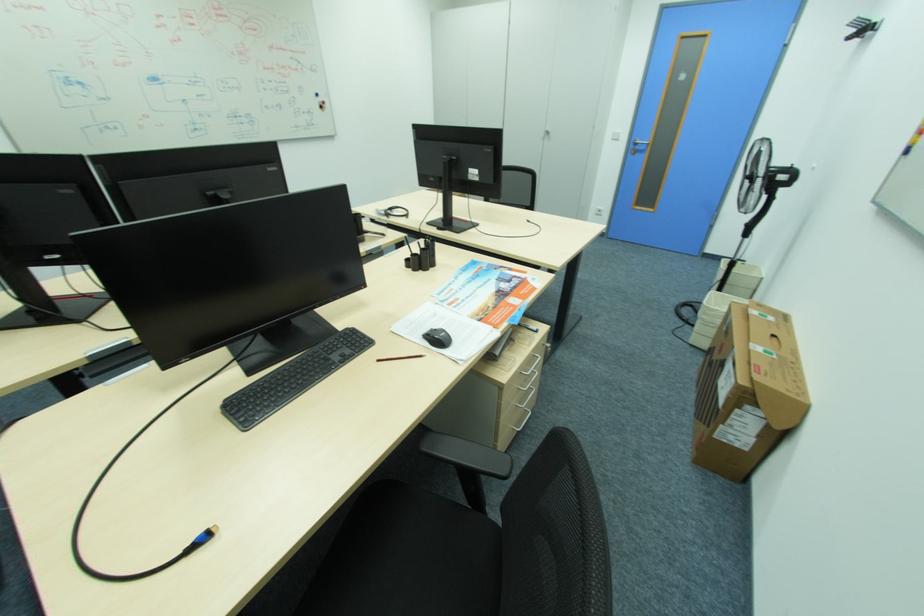
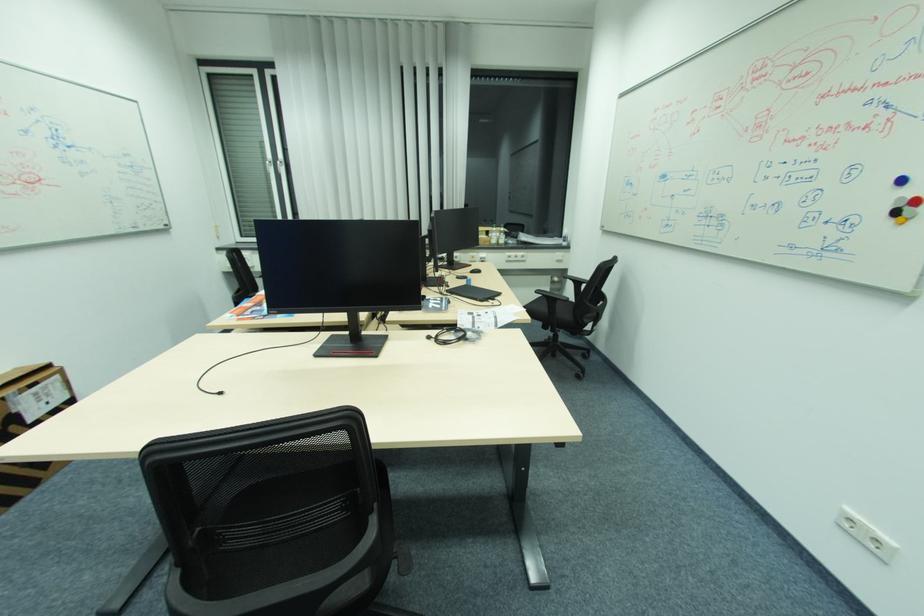
Find the pixel in the second image that matches point 323,97 in the first image.

(908, 180)